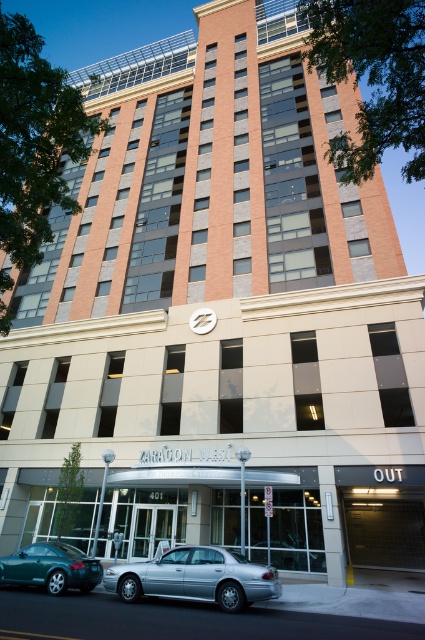
Question: Which point is farther to the camera?

Choices:
 (A) silver metallic sedan at lower center
 (B) green matte car at lower left

Answer: (B)

Question: Does silver metallic sedan at lower center have a larger size compared to green matte car at lower left?

Choices:
 (A) no
 (B) yes

Answer: (B)

Question: Does silver metallic sedan at lower center have a greater width compared to green matte car at lower left?

Choices:
 (A) yes
 (B) no

Answer: (A)

Question: Can you confirm if silver metallic sedan at lower center is bigger than green matte car at lower left?

Choices:
 (A) yes
 (B) no

Answer: (A)